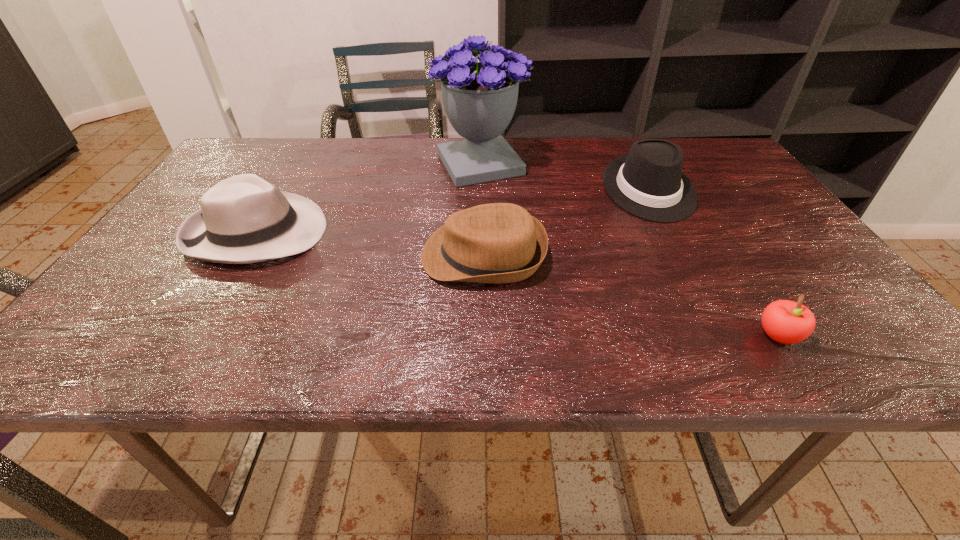
The height and width of the screenshot is (540, 960). I want to click on the tallest object, so click(479, 98).

I want to click on the leftmost object, so click(x=243, y=219).

Find the location of a particular element. The width and height of the screenshot is (960, 540). the rightmost fedora is located at coordinates (648, 182).

Where is `the shortest fedora`? The height and width of the screenshot is (540, 960). the shortest fedora is located at coordinates (499, 243).

At what (x,y) coordinates should I click in order to perform the action: click on apple. Please return your answer as a coordinate pair (x, y). This screenshot has height=540, width=960. Looking at the image, I should click on (787, 322).

The image size is (960, 540). I want to click on vacant space positioned 0.380m on the right of the tallest object, so (x=660, y=164).

Identify the location of free spot located on the front-facing side of the leftmost fedora. (386, 232).

This screenshot has height=540, width=960. Identify the location of vacant point located 0.190m on the front-facing side of the rightmost fedora. click(694, 278).

At what (x,y) coordinates should I click in order to perform the action: click on blank area located 0.140m on the front-facing side of the second fedora from right to left. Please return your answer as a coordinate pair (x, y). Looking at the image, I should click on (357, 255).

I want to click on free space located on the front-facing side of the second fedora from right to left, so click(x=292, y=255).